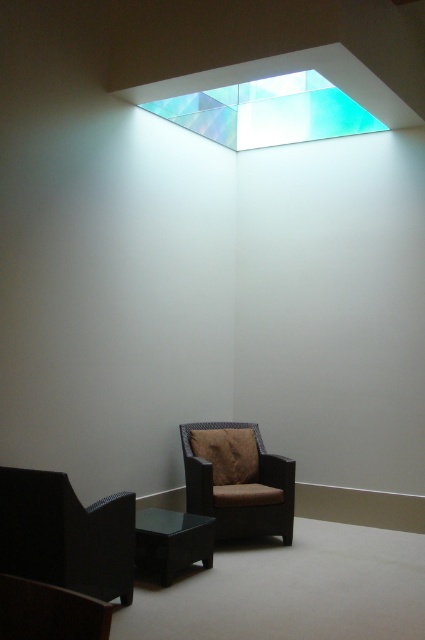
You are sitting in the brown woven armchair at lower center and want to place a book on the black glass coffee table at lower center. Can you easily reach the table from your current position?

The brown woven armchair at lower center is further to the viewer than the black glass coffee table at lower center, so you can easily reach the table since it is closer to you.

You are standing in the minimalist interior space and want to move from the point at coordinates point [59,499] to the point at coordinates point [227,448]. According to the scene description, which direction should you walk to reach your destination?

You should walk backward because point [59,499] is in front of point [227,448], so moving away from the direction you are facing will lead you towards the destination.

You are sitting on the brown woven armchair at lower center and want to move to the matte black armchair at lower left. Which direction should you move in?

You should move to the left to reach the matte black armchair at lower left since it is positioned to the left of the brown woven armchair at lower center.